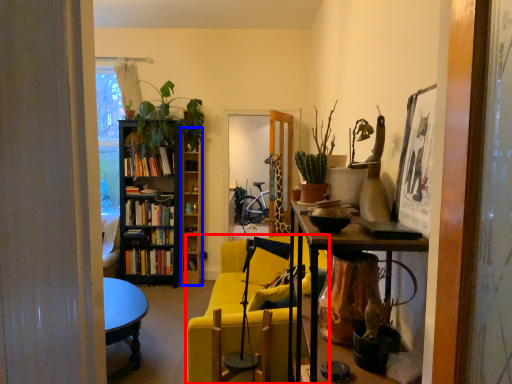
Question: Among these objects, which one is farthest to the camera, chair (highlighted by a red box) or shelf (highlighted by a blue box)?

Choices:
 (A) chair
 (B) shelf

Answer: (B)